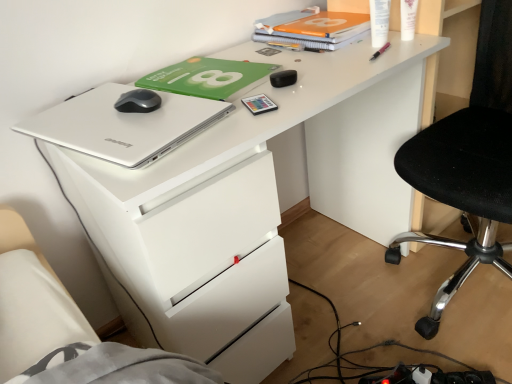
Where is `vacant area that lies to the right of satin black mouse at upper left`? The width and height of the screenshot is (512, 384). vacant area that lies to the right of satin black mouse at upper left is located at coordinates (182, 104).